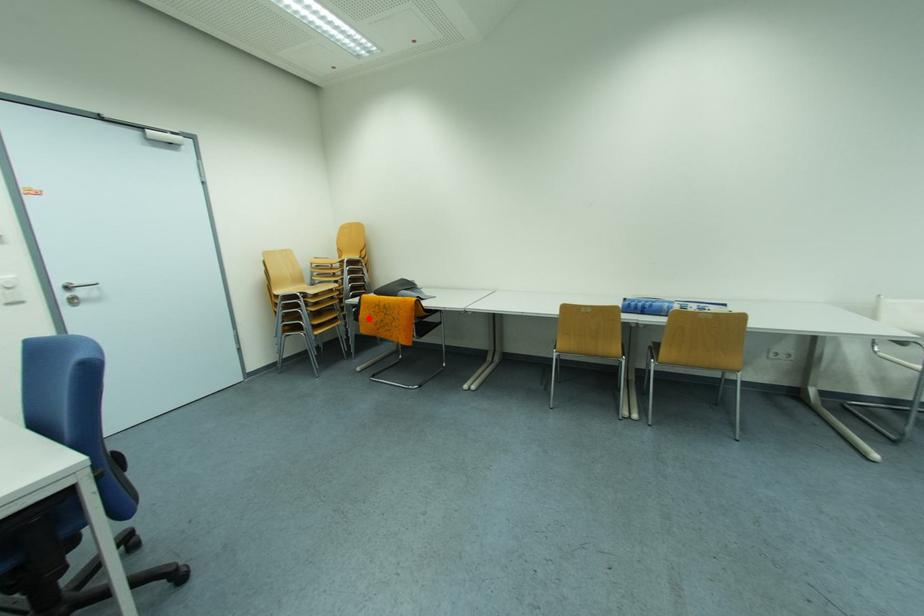
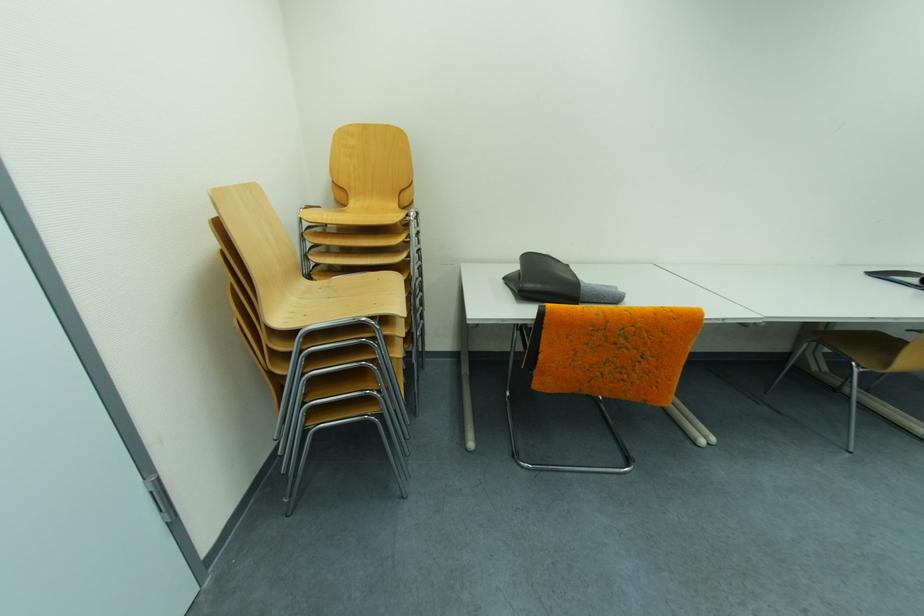
Question: I am providing you with two images of the same scene from different viewpoints. A red point is marked on the first image. Is the red point's position out of view in image 2?

Choices:
 (A) Yes
 (B) No

Answer: (B)